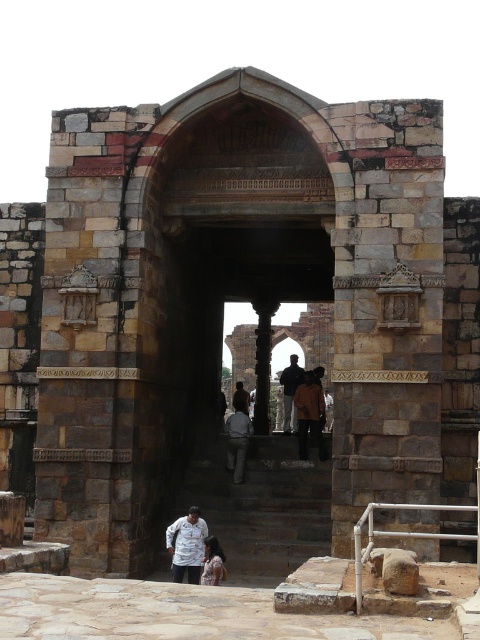
Can you confirm if light gray fabric pants at center is taller than light brown fabric shirt at center?

Correct, light gray fabric pants at center is much taller as light brown fabric shirt at center.

Who is more forward, (252, 428) or (206, 582)?

Point (206, 582) is more forward.

Find the location of a particular element. The width and height of the screenshot is (480, 640). light gray fabric pants at center is located at coordinates (238, 440).

Does brown stone stairs at center appear over dark brown leather jacket at center?

Incorrect, brown stone stairs at center is not positioned above dark brown leather jacket at center.

Can you confirm if brown stone stairs at center is wider than dark brown leather jacket at center?

Correct, the width of brown stone stairs at center exceeds that of dark brown leather jacket at center.

What do you see at coordinates (263, 506) in the screenshot?
I see `brown stone stairs at center` at bounding box center [263, 506].

Where is `brown stone stairs at center`? The height and width of the screenshot is (640, 480). brown stone stairs at center is located at coordinates (263, 506).

Between light brown fabric shirt at center and dark brown leather jacket at center, which one appears on the right side from the viewer's perspective?

From the viewer's perspective, dark brown leather jacket at center appears more on the right side.

Does light brown fabric shirt at center lie in front of dark brown leather jacket at center?

Yes, light brown fabric shirt at center is closer to the viewer.

Locate an element on the screen. This screenshot has height=640, width=480. light brown fabric shirt at center is located at coordinates (213, 563).